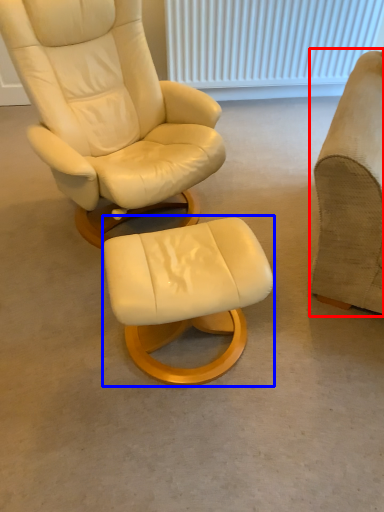
Question: Among these objects, which one is farthest to the camera, chair (highlighted by a red box) or stool (highlighted by a blue box)?

Choices:
 (A) chair
 (B) stool

Answer: (B)